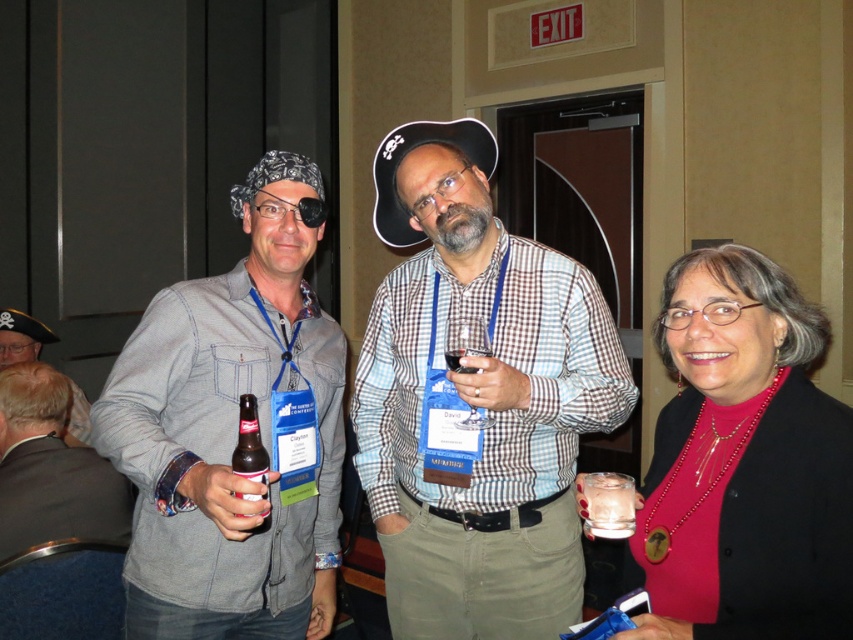
Question: Can you confirm if matte black pirate hat at left is positioned to the left of brown glass bottle at center?

Choices:
 (A) yes
 (B) no

Answer: (A)

Question: Which object appears closest to the camera in this image?

Choices:
 (A) matte black pirate hat at left
 (B) denim jacket at left
 (C) matte black blazer at center
 (D) denim shirt at left

Answer: (C)

Question: Can you confirm if denim shirt at left is thinner than matte black blazer at center?

Choices:
 (A) yes
 (B) no

Answer: (A)

Question: Which of the following is the farthest from the observer?

Choices:
 (A) clear glass wine at center
 (B) brown glass bottle at center
 (C) checkered fabric shirt at center
 (D) matte black blazer at center

Answer: (A)

Question: Which point is closer to the camera?

Choices:
 (A) clear glass wine at center
 (B) matte black blazer at center
 (C) denim jacket at left

Answer: (B)

Question: Is denim jacket at left below matte black pirate hat at left?

Choices:
 (A) yes
 (B) no

Answer: (A)